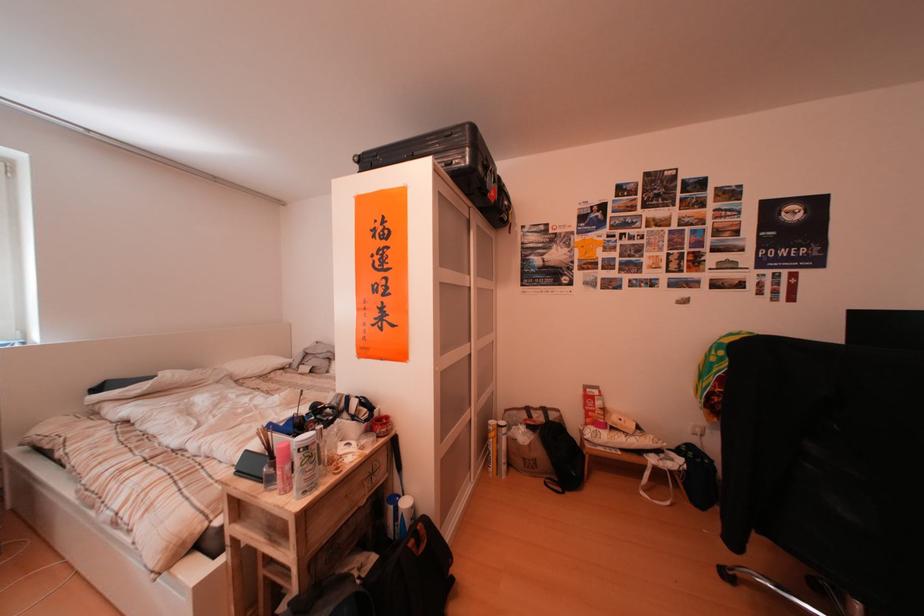
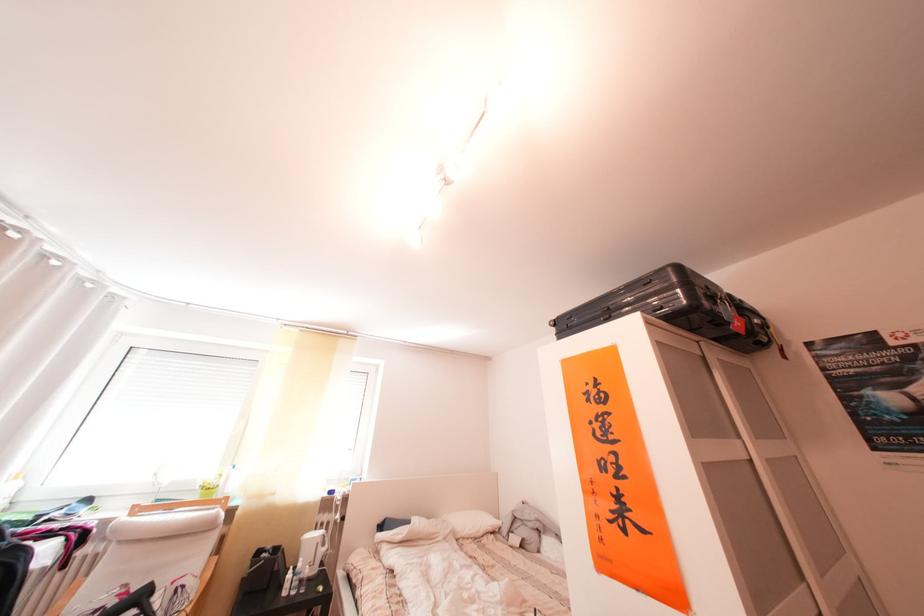
Where in the second image is the point corresponding to point 293,371 from the first image?

(504, 535)